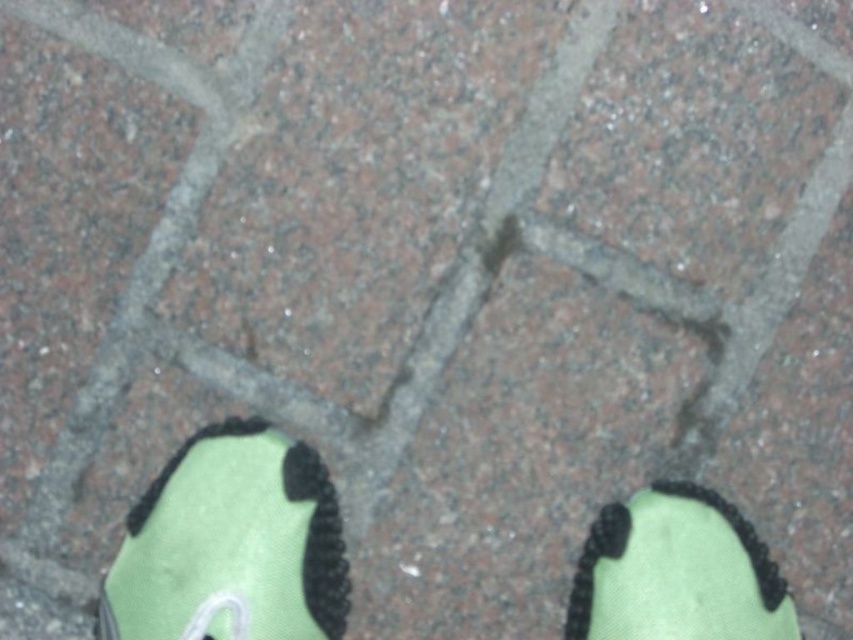
Question: Among these points, which one is nearest to the camera?

Choices:
 (A) (648, 490)
 (B) (303, 566)

Answer: (B)

Question: Which point is closer to the camera taking this photo?

Choices:
 (A) (235, 515)
 (B) (722, 502)

Answer: (A)

Question: Can you confirm if green fabric shoe at lower center is positioned to the left of green fabric shoe at lower right?

Choices:
 (A) no
 (B) yes

Answer: (B)

Question: Does green fabric shoe at lower center come behind green fabric shoe at lower right?

Choices:
 (A) yes
 (B) no

Answer: (B)

Question: Does green fabric shoe at lower center have a smaller size compared to green fabric shoe at lower right?

Choices:
 (A) yes
 (B) no

Answer: (B)